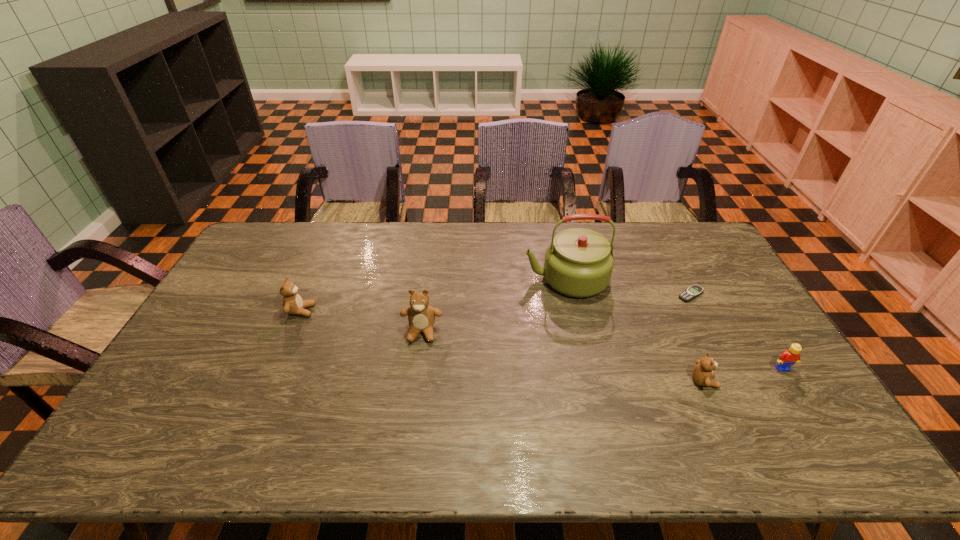
Locate an element on the screen. the leftmost teddy bear is located at coordinates (293, 304).

The image size is (960, 540). In order to click on the third tallest object in this screenshot , I will do `click(293, 304)`.

What are the coordinates of `the second teddy bear from right to left` in the screenshot? It's located at (421, 316).

The width and height of the screenshot is (960, 540). Identify the location of the tallest teddy bear. (421, 316).

At what (x,y) coordinates should I click in order to perform the action: click on the rightmost teddy bear. Please return your answer as a coordinate pair (x, y). Looking at the image, I should click on (702, 373).

You are a GUI agent. You are given a task and a screenshot of the screen. Output one action in this format:
    pyautogui.click(x=<x>, y=<y>)
    Task: Click on the nearest teddy bear
    
    Given the screenshot: What is the action you would take?
    pyautogui.click(x=702, y=373)

Image resolution: width=960 pixels, height=540 pixels. Identify the location of beeper. coord(695,290).

Identify the location of the second object from right to left. (695, 290).

This screenshot has height=540, width=960. What are the coordinates of `kettle` in the screenshot? It's located at (578, 262).

This screenshot has width=960, height=540. I want to click on the fourth object from right to left, so click(x=578, y=262).